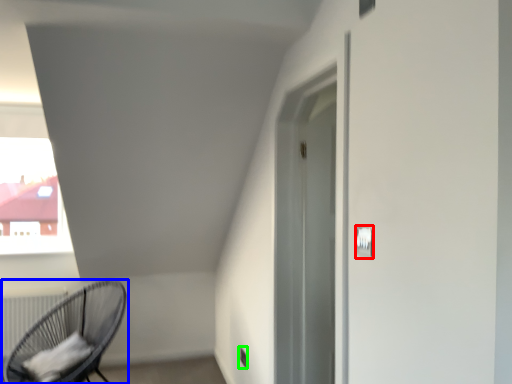
Question: Which object is the closest to the light switch (highlighted by a red box)? Choose among these: chair (highlighted by a blue box) or electric outlet (highlighted by a green box).

Choices:
 (A) chair
 (B) electric outlet

Answer: (B)